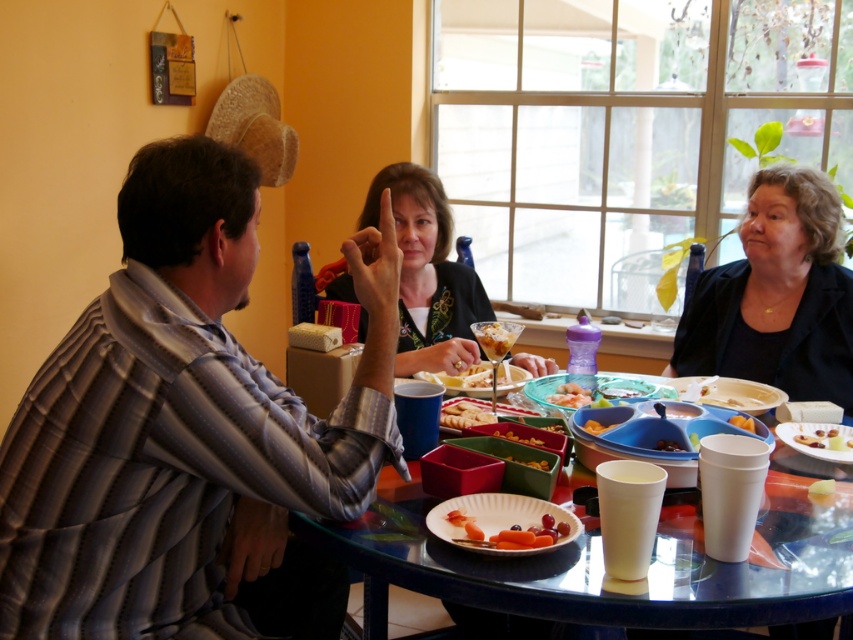
Question: Considering the real-world distances, which object is farthest from the smooth white cheese sticks at center?

Choices:
 (A) black matte jacket at right
 (B) orange plastic tray at center
 (C) white plastic platter at lower right
 (D) striped shirt at left

Answer: (A)

Question: From the image, what is the correct spatial relationship of smooth white cheese at center in relation to orange plastic tray at center?

Choices:
 (A) below
 (B) above

Answer: (A)

Question: Does translucent glass table at center come in front of slightly browned bread at center?

Choices:
 (A) no
 (B) yes

Answer: (B)

Question: Which is farther from the white plastic platter at lower right?

Choices:
 (A) black matte jacket at right
 (B) yellow matte carrot at center
 (C) slightly browned bread at center

Answer: (C)

Question: Can you confirm if translucent glass table at center is positioned above carrot sticks at center?

Choices:
 (A) yes
 (B) no

Answer: (A)

Question: Which of the following is the closest to the observer?

Choices:
 (A) translucent glass table at center
 (B) yellow matte carrot at center

Answer: (A)